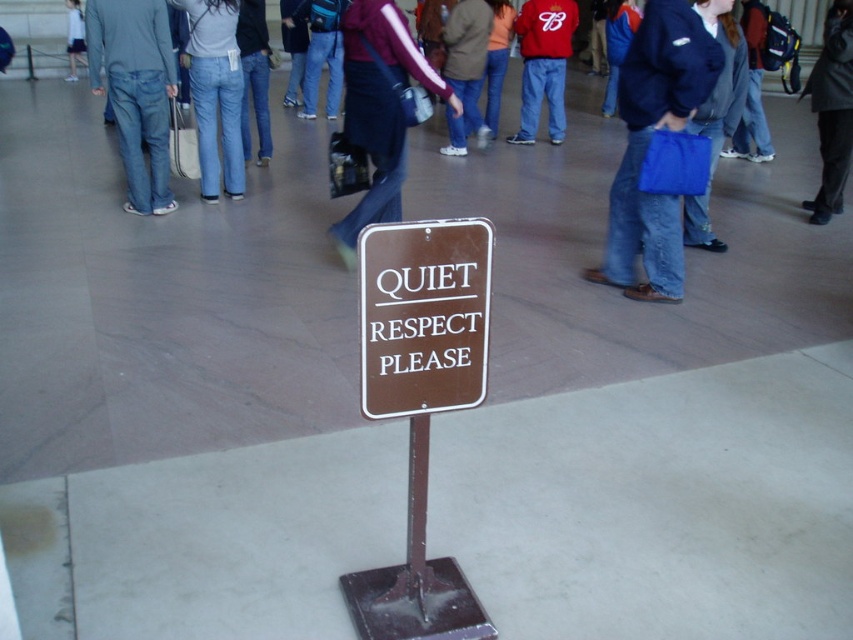
Question: Which point is closer to the camera taking this photo?

Choices:
 (A) (683, 12)
 (B) (415, 612)
 (C) (155, 157)
 (D) (525, 141)

Answer: (B)

Question: Which object appears farthest from the camera in this image?

Choices:
 (A) dark blue jeans at center
 (B) blue fabric bag at center
 (C) brown metal sign at center
 (D) dark gray jacket at center

Answer: (D)

Question: Does brown metal sign at center appear on the right side of dark gray jacket at center?

Choices:
 (A) no
 (B) yes

Answer: (A)

Question: Is brown metal sign at center to the left of dark blue jeans at center from the viewer's perspective?

Choices:
 (A) no
 (B) yes

Answer: (A)

Question: Which point is closer to the camera?

Choices:
 (A) (357, 86)
 (B) (654, 36)
 (C) (827, 44)

Answer: (B)

Question: Considering the relative positions of brown metal sign at center and red cotton hoodie at center in the image provided, where is brown metal sign at center located with respect to red cotton hoodie at center?

Choices:
 (A) left
 (B) right

Answer: (A)